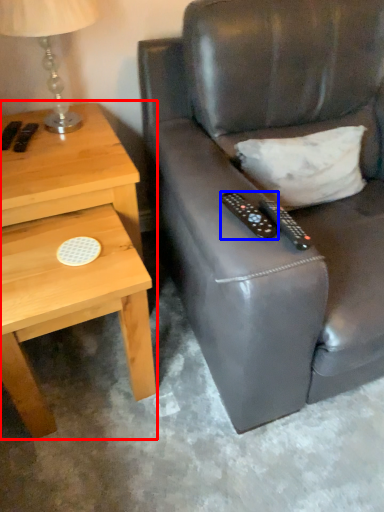
Question: Among these objects, which one is farthest to the camera, nightstand (highlighted by a red box) or remote control (highlighted by a blue box)?

Choices:
 (A) nightstand
 (B) remote control

Answer: (A)